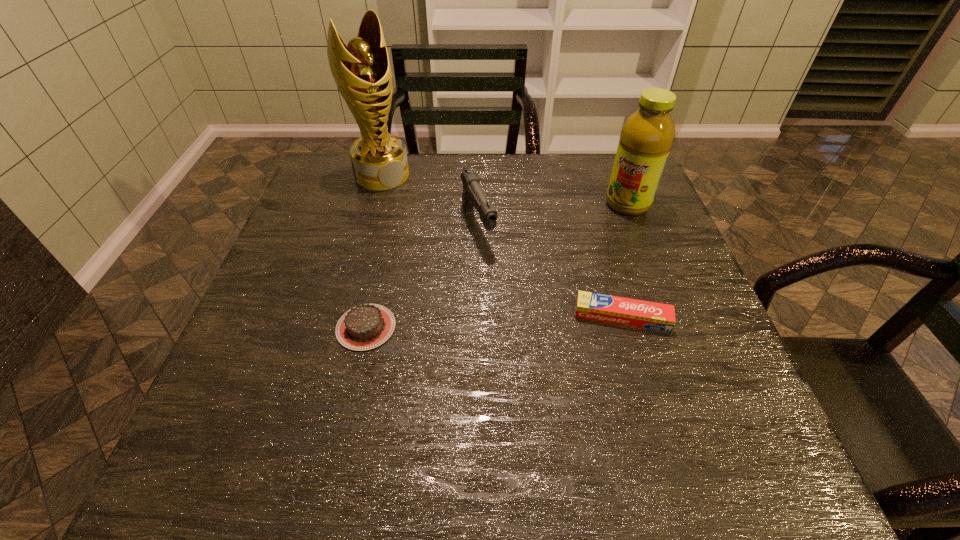
Image resolution: width=960 pixels, height=540 pixels. Find the location of `toothpaste located in the right edge section of the desktop`. toothpaste located in the right edge section of the desktop is located at coordinates (625, 311).

This screenshot has width=960, height=540. I want to click on fruit juice present at the right edge, so click(647, 135).

Locate an element on the screen. object present at the far left corner is located at coordinates (362, 72).

Where is `object that is positioned at the far right corner`? object that is positioned at the far right corner is located at coordinates (647, 135).

Image resolution: width=960 pixels, height=540 pixels. Identify the location of vacant area at the far edge. (414, 190).

The image size is (960, 540). In the image, there is a desktop. In order to click on free space at the near edge in this screenshot , I will do point(564,391).

Identify the location of blank space at the left edge of the desktop. (285, 260).

Image resolution: width=960 pixels, height=540 pixels. In the image, there is a desktop. Identify the location of free space at the right edge. (626, 276).

Find the location of a particular element. free space at the far left corner is located at coordinates (338, 199).

Identify the location of free spot at the near right corner of the desktop. The height and width of the screenshot is (540, 960). (752, 416).